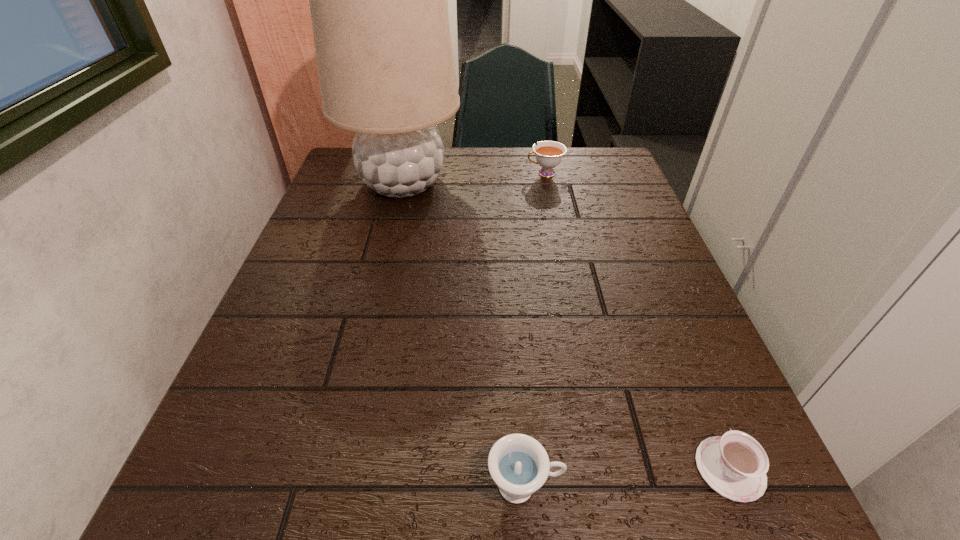
Locate an element on the screen. free space between the third object from left to right and the third object from right to left is located at coordinates (535, 329).

Where is `unoccupied position between the second object from left to right and the lampshade`? This screenshot has height=540, width=960. unoccupied position between the second object from left to right and the lampshade is located at coordinates (464, 334).

The height and width of the screenshot is (540, 960). What are the coordinates of `vacant space in between the shortest teacup and the second teacup from right to left` in the screenshot? It's located at (637, 321).

This screenshot has width=960, height=540. Identify the location of free point between the lampshade and the shortest object. (566, 326).

Find the location of `free space between the lampshade and the rightmost object`. free space between the lampshade and the rightmost object is located at coordinates (566, 326).

The width and height of the screenshot is (960, 540). I want to click on free area in between the leftmost teacup and the tallest object, so click(x=464, y=334).

Identify the location of vacant space that's between the third object from left to right and the second object from left to right. 535,329.

Locate an element on the screen. This screenshot has width=960, height=540. vacant point located between the leftmost teacup and the shortest teacup is located at coordinates click(x=627, y=477).

Select which object is the third closest to the lampshade. Please provide its 2D coordinates. Your answer should be formatted as a tuple, i.e. [(x, y)], where the tuple contains the x and y coordinates of a point satisfying the conditions above.

[(735, 465)]

The image size is (960, 540). I want to click on the third closest object to the shortest teacup, so click(x=549, y=154).